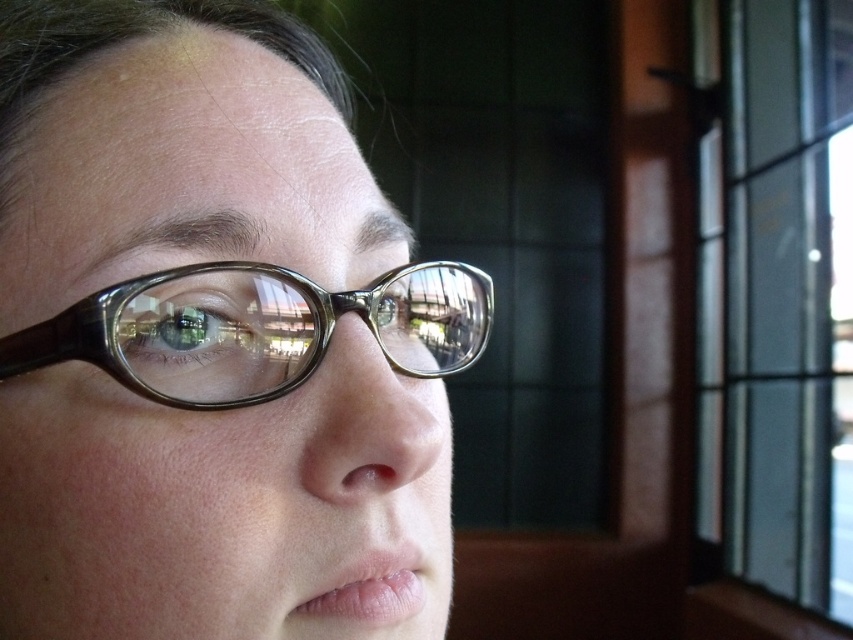
Does point (146, 145) lie in front of point (799, 141)?

Yes, it is.

Between point (409, 394) and point (824, 33), which one is positioned behind?

The point (824, 33) is behind.

Is point (276, 497) closer to viewer compared to point (727, 374)?

That is True.

Image resolution: width=853 pixels, height=640 pixels. I want to click on transparent plastic glasses at center, so click(x=212, y=339).

From the picture: Does transparent plastic glasses at center have a smaller size compared to translucent plastic glasses at center?

No, transparent plastic glasses at center is not smaller than translucent plastic glasses at center.

How far apart are transparent plastic glasses at center and translucent plastic glasses at center?

The distance of transparent plastic glasses at center from translucent plastic glasses at center is 1.76 inches.

Image resolution: width=853 pixels, height=640 pixels. In order to click on transparent plastic glasses at center in this screenshot , I will do `click(212, 339)`.

Does point (708, 177) come behind point (62, 321)?

That is True.

Is transparent glass window at upper right to the right of translucent plastic glasses at center from the viewer's perspective?

Correct, you'll find transparent glass window at upper right to the right of translucent plastic glasses at center.

This screenshot has height=640, width=853. I want to click on transparent glass window at upper right, so click(776, 294).